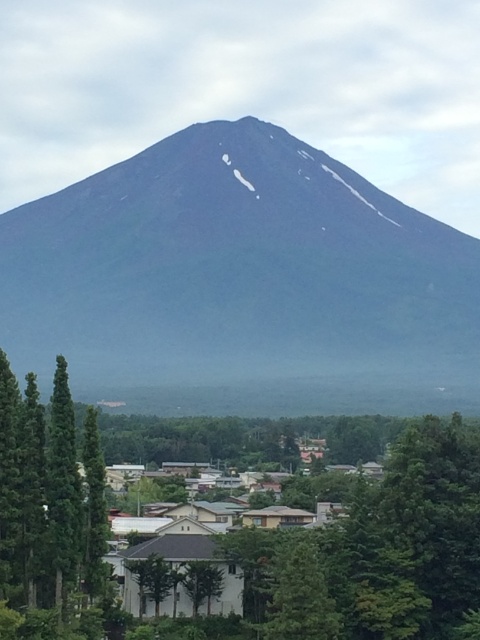
Question: Which of the following is the closest to the observer?

Choices:
 (A) dark gray rock mountain at center
 (B) green matte tree at lower left

Answer: (B)

Question: Can you confirm if dark gray rock mountain at center is wider than green matte tree at lower left?

Choices:
 (A) no
 (B) yes

Answer: (B)

Question: Can you confirm if dark gray rock mountain at center is thinner than green matte tree at lower left?

Choices:
 (A) no
 (B) yes

Answer: (A)

Question: Which of the following is the farthest from the observer?

Choices:
 (A) dark gray rock mountain at center
 (B) green matte tree at lower left

Answer: (A)

Question: Is dark gray rock mountain at center above green matte tree at lower left?

Choices:
 (A) no
 (B) yes

Answer: (B)